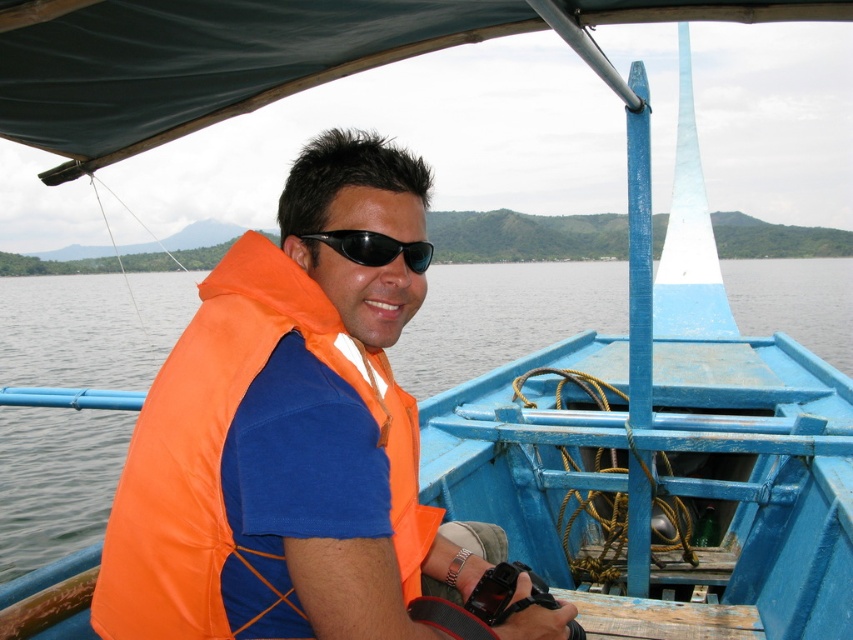
Does orange fabric life jacket at left appear under black plastic sunglasses at center?

Yes, orange fabric life jacket at left is below black plastic sunglasses at center.

You are a GUI agent. You are given a task and a screenshot of the screen. Output one action in this format:
    pyautogui.click(x=<x>, y=<y>)
    Task: Click on the orange fabric life jacket at left
    
    Given the screenshot: What is the action you would take?
    pyautogui.click(x=224, y=460)